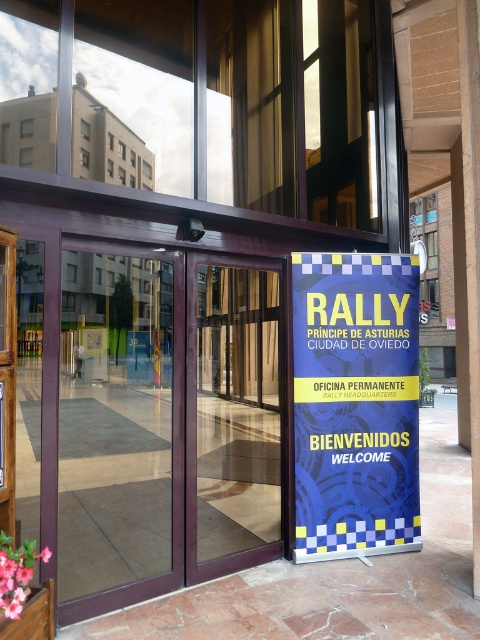
Question: Which object appears closest to the camera in this image?

Choices:
 (A) transparent glass door at center
 (B) matte glass door at center
 (C) blue/yellow checkered banner at right

Answer: (A)

Question: Does transparent glass door at center lie in front of matte glass door at center?

Choices:
 (A) no
 (B) yes

Answer: (B)

Question: Among these objects, which one is nearest to the camera?

Choices:
 (A) blue/yellow checkered banner at right
 (B) matte glass door at center

Answer: (B)

Question: Does transparent glass door at center have a greater width compared to matte glass door at center?

Choices:
 (A) yes
 (B) no

Answer: (A)

Question: Considering the real-world distances, which object is closest to the transparent glass door at center?

Choices:
 (A) blue/yellow checkered banner at right
 (B) matte glass door at center

Answer: (B)

Question: Can you confirm if blue/yellow checkered banner at right is positioned above matte glass door at center?

Choices:
 (A) yes
 (B) no

Answer: (A)